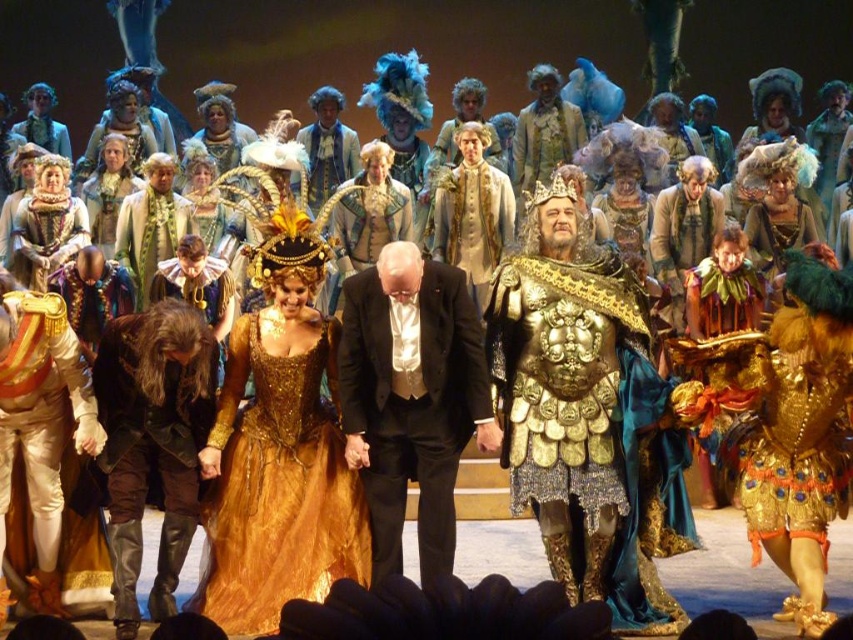
From the picture: You are an audience member sitting in the front row of the theater. You notice the gold sequined dress at center and the black satin suit at center. Which one is positioned lower from your viewpoint?

The gold sequined dress at center is located below the black satin suit at center, so it is positioned lower from your viewpoint.

You are an event planner setting up a photo shoot on the stage. You need to position a spotlight that can illuminate both the gold metallic armor at center and the gold sequined dress at center without any obstruction. Based on their positions, which object should the spotlight be placed in front of to ensure both are lit properly?

The gold sequined dress at center is behind gold metallic armor at center, so the spotlight should be placed in front of the gold metallic armor at center to ensure both are illuminated without obstruction.

You are a stagehand preparing to adjust the lighting for the performance. You need to ensure that the black satin suit at center is illuminated properly. Since the gold sequined dress at center is blocking the light, can you move the dress to the side to allow light to reach the suit?

The black satin suit at center is behind the gold sequined dress at center, so moving the gold sequined dress at center aside would allow light to reach the black satin suit at center.